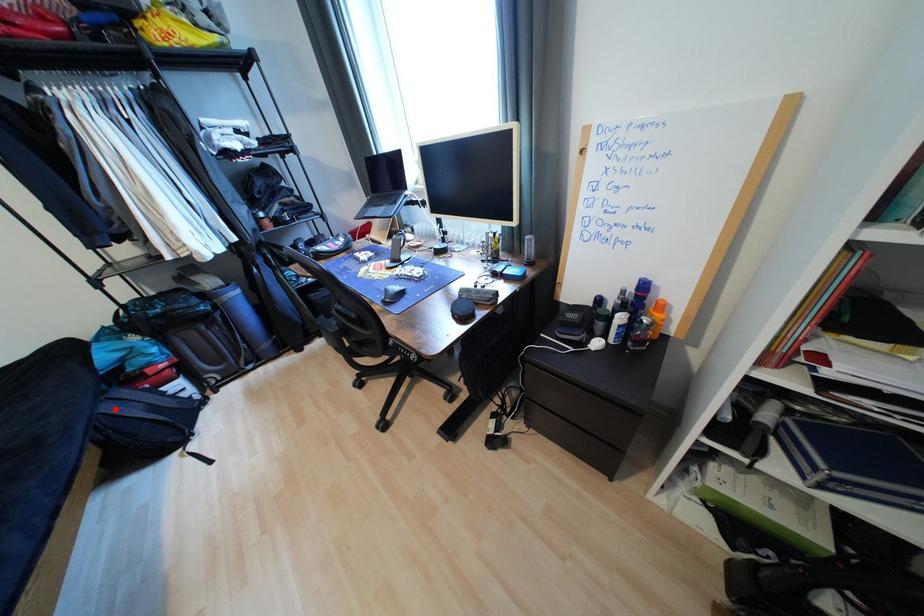
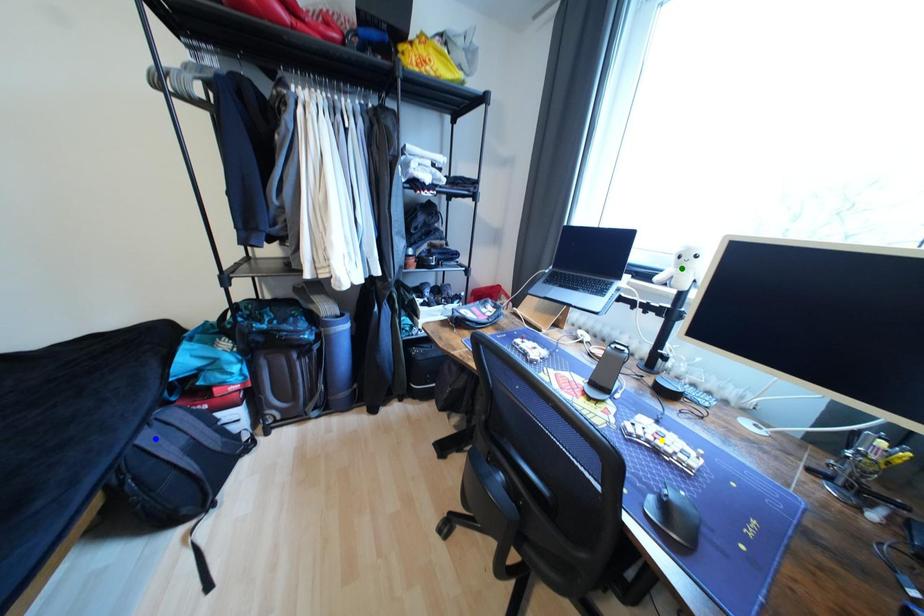
Question: I am providing you with two images of the same scene from different viewpoints. A red point is marked on the first image. You are given multiple points on the second image. In image 2, which mark is for the same physical point as the one in image 1?

Choices:
 (A) green point
 (B) yellow point
 (C) blue point

Answer: (C)